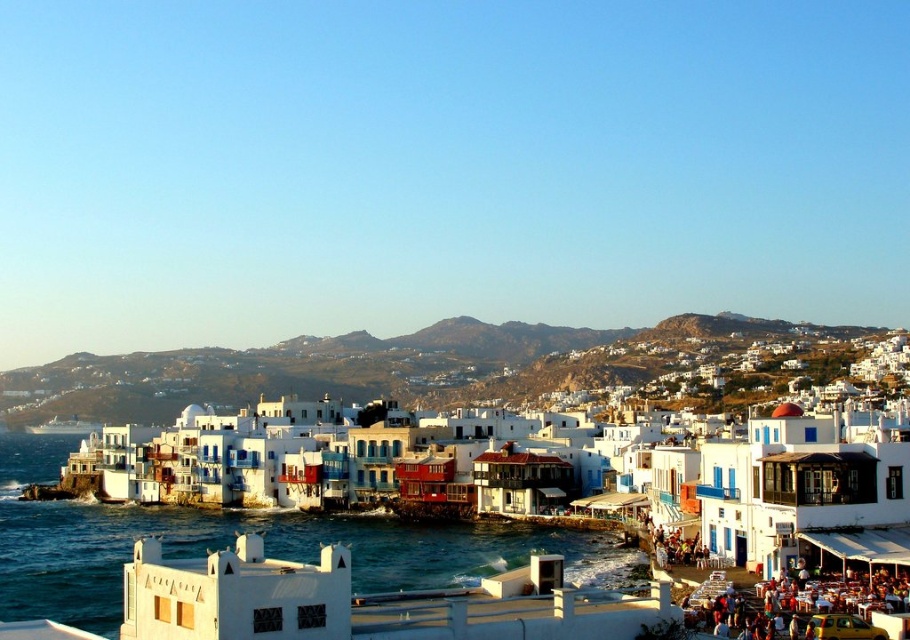
Question: In this image, where is white painted buildings at center located relative to clear blue water at lower center?

Choices:
 (A) below
 (B) above

Answer: (B)

Question: Is white painted buildings at center to the left of clear blue water at lower center from the viewer's perspective?

Choices:
 (A) no
 (B) yes

Answer: (A)

Question: Which point is closer to the camera?

Choices:
 (A) (9, 497)
 (B) (422, 442)

Answer: (B)

Question: Which point appears farthest from the camera in this image?

Choices:
 (A) (578, 372)
 (B) (76, 516)

Answer: (A)

Question: Is white painted buildings at center further to the viewer compared to clear blue water at lower center?

Choices:
 (A) no
 (B) yes

Answer: (A)

Question: Which point is farther from the camera taking this photo?

Choices:
 (A) (381, 524)
 (B) (304, 445)

Answer: (B)